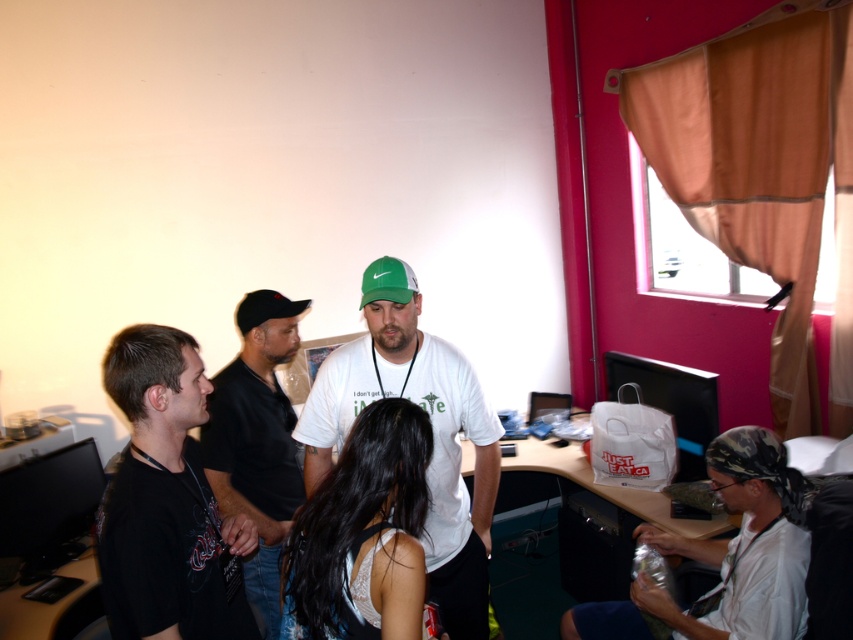
Is white matte t-shirt at center taller than black matte baseball cap at left?

Indeed, white matte t-shirt at center has a greater height compared to black matte baseball cap at left.

Does white matte t-shirt at center have a smaller size compared to black matte baseball cap at left?

Incorrect, white matte t-shirt at center is not smaller in size than black matte baseball cap at left.

The width and height of the screenshot is (853, 640). In order to click on white matte t-shirt at center in this screenshot , I will do `click(433, 444)`.

The height and width of the screenshot is (640, 853). What do you see at coordinates (166, 500) in the screenshot?
I see `black matte t-shirt at left` at bounding box center [166, 500].

This screenshot has width=853, height=640. What do you see at coordinates (166, 500) in the screenshot?
I see `black matte t-shirt at left` at bounding box center [166, 500].

This screenshot has width=853, height=640. I want to click on black matte t-shirt at left, so click(166, 500).

Does wooden desk at lower left come behind black matte baseball cap at left?

That is False.

Looking at this image, which of these two, wooden desk at lower left or black matte baseball cap at left, stands shorter?

With less height is black matte baseball cap at left.

This screenshot has width=853, height=640. I want to click on wooden desk at lower left, so click(x=53, y=604).